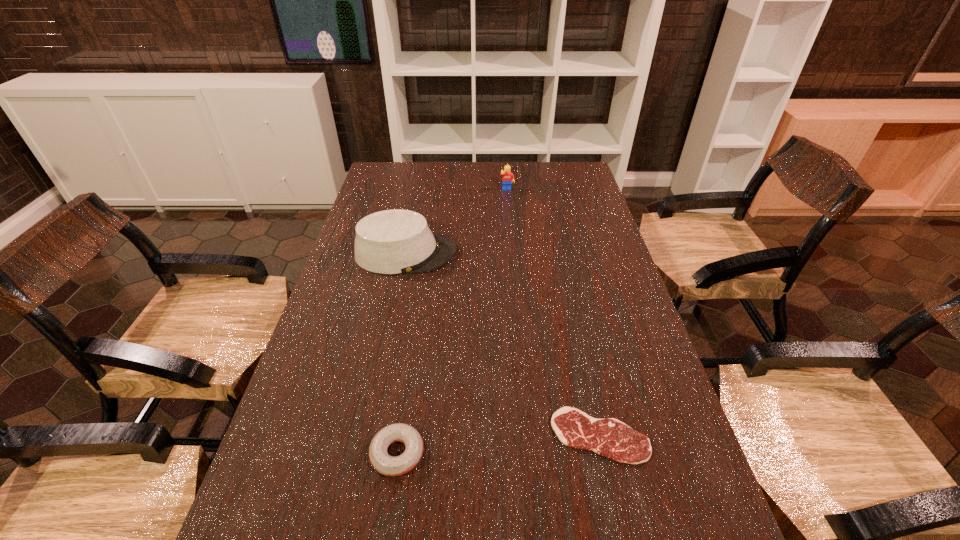
Where is `the third nearest object`? The height and width of the screenshot is (540, 960). the third nearest object is located at coordinates (397, 241).

The height and width of the screenshot is (540, 960). What are the coordinates of `the farthest object` in the screenshot? It's located at (508, 177).

You are a GUI agent. You are given a task and a screenshot of the screen. Output one action in this format:
    pyautogui.click(x=<x>, y=<y>)
    Task: Click on the second object from right to left
    This screenshot has height=540, width=960.
    Given the screenshot: What is the action you would take?
    pyautogui.click(x=508, y=177)

The image size is (960, 540). I want to click on the third tallest object, so click(385, 464).

Identify the location of steak. The image size is (960, 540). (608, 437).

The image size is (960, 540). I want to click on the rightmost object, so click(x=608, y=437).

Identify the location of vacant space located 0.270m on the front-facing side of the second farthest object. (539, 253).

At what (x,y) coordinates should I click in order to perform the action: click on free region located 0.210m on the face of the farthest object. Please return your answer as a coordinate pair (x, y). The width and height of the screenshot is (960, 540). Looking at the image, I should click on (510, 223).

Locate an element on the screen. The height and width of the screenshot is (540, 960). free spot located 0.380m on the back of the second shortest object is located at coordinates (419, 308).

Locate an element on the screen. This screenshot has height=540, width=960. vacant space located 0.100m on the back of the steak is located at coordinates (586, 373).